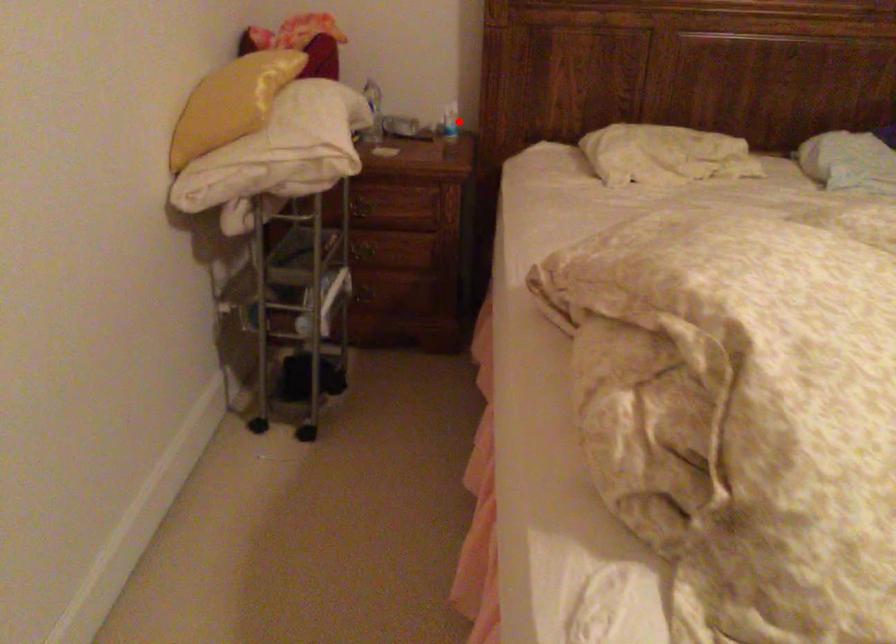
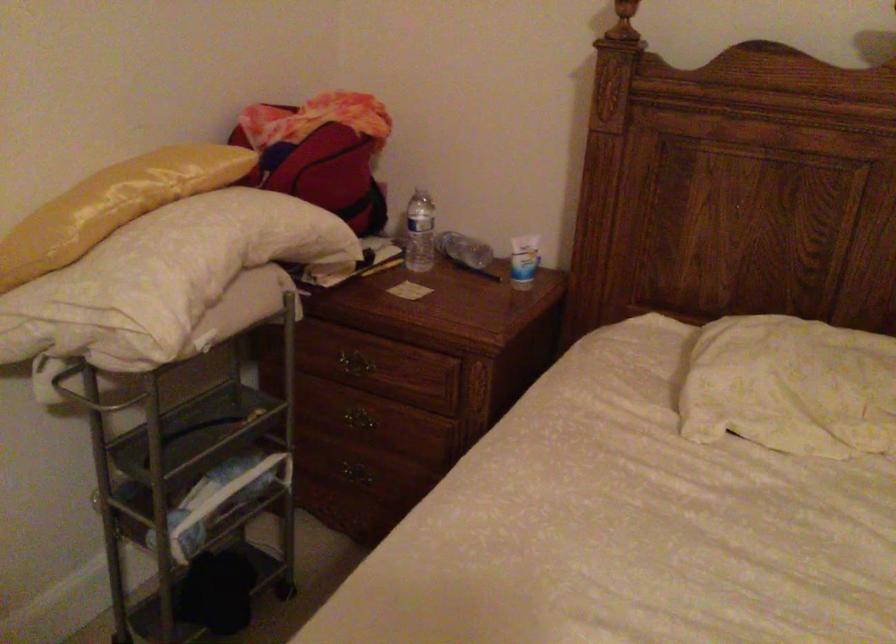
Find the pixel in the second image that matches the highlighted location in the first image.

(523, 261)